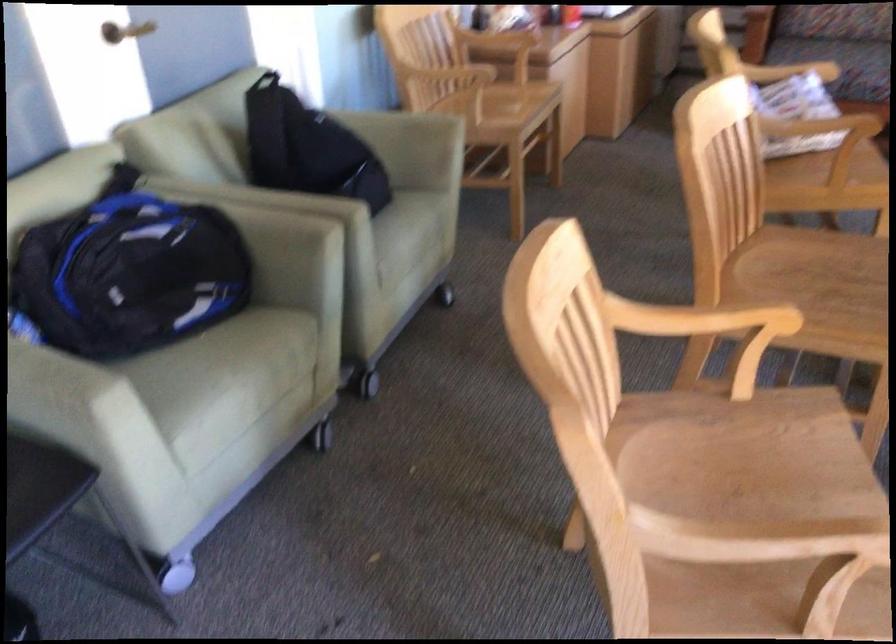
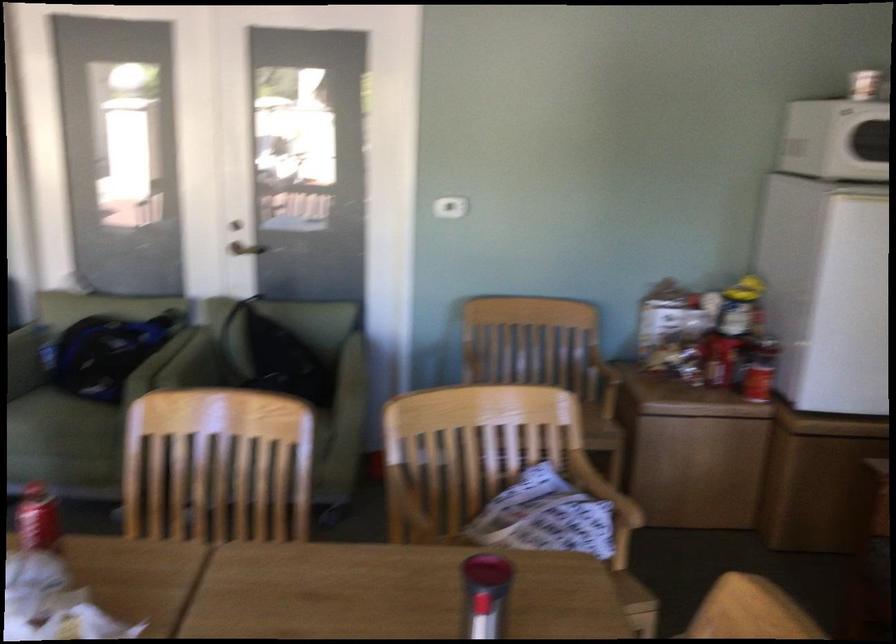
Find the pixel in the second image that matches point 231,355 in the first image.

(61, 424)